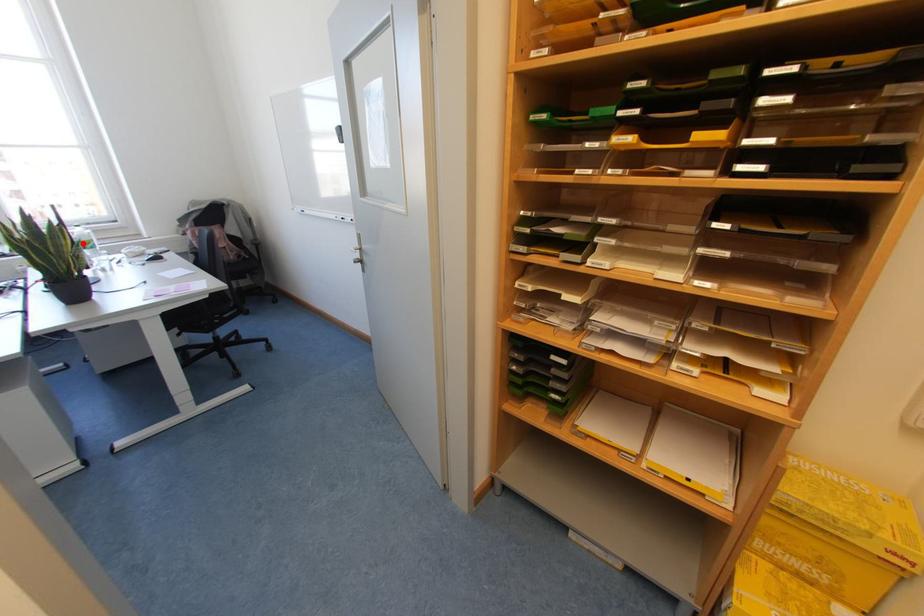
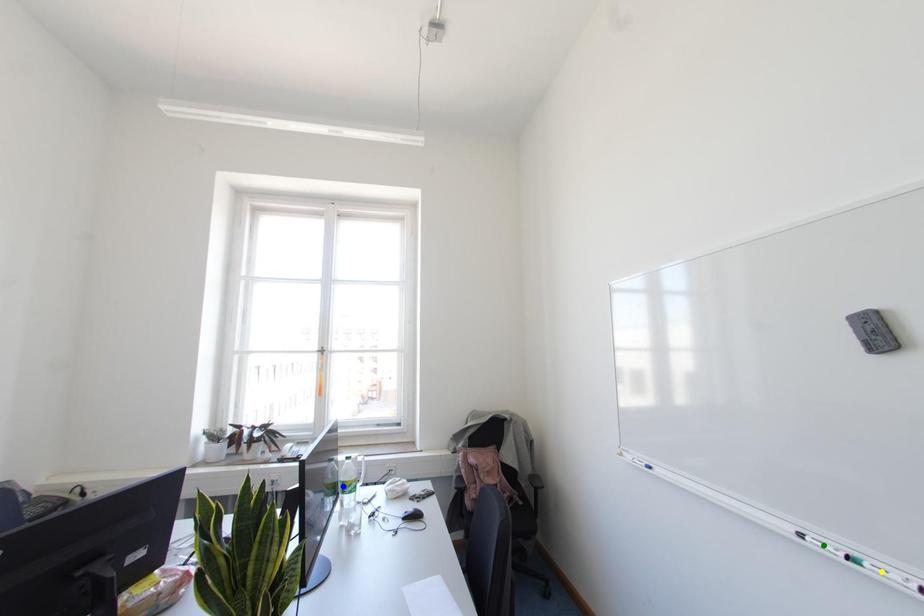
Question: I am providing you with two images of the same scene from different viewpoints. A red point is marked on the first image. You are given multiple points on the second image. Which point in image 2 represents the same 3d spot as the red point in image 1?

Choices:
 (A) green point
 (B) yellow point
 (C) blue point

Answer: (C)